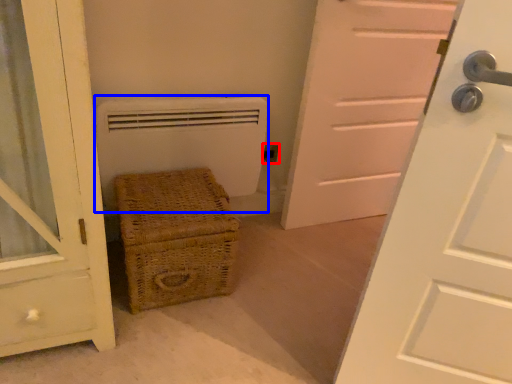
Question: Which point is closer to the camera, electric outlet (highlighted by a red box) or heater (highlighted by a blue box)?

Choices:
 (A) electric outlet
 (B) heater

Answer: (B)